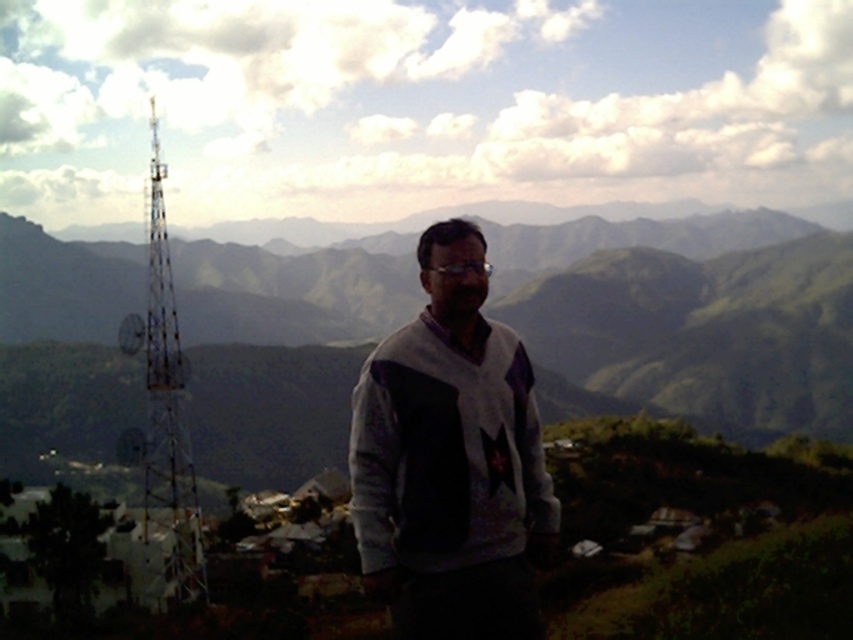
Can you confirm if green grassy mountain at center is bigger than white knitwear at center?

Correct, green grassy mountain at center is larger in size than white knitwear at center.

Can you confirm if green grassy mountain at center is smaller than white knitwear at center?

No.

Where is `green grassy mountain at center`? Image resolution: width=853 pixels, height=640 pixels. green grassy mountain at center is located at coordinates (686, 326).